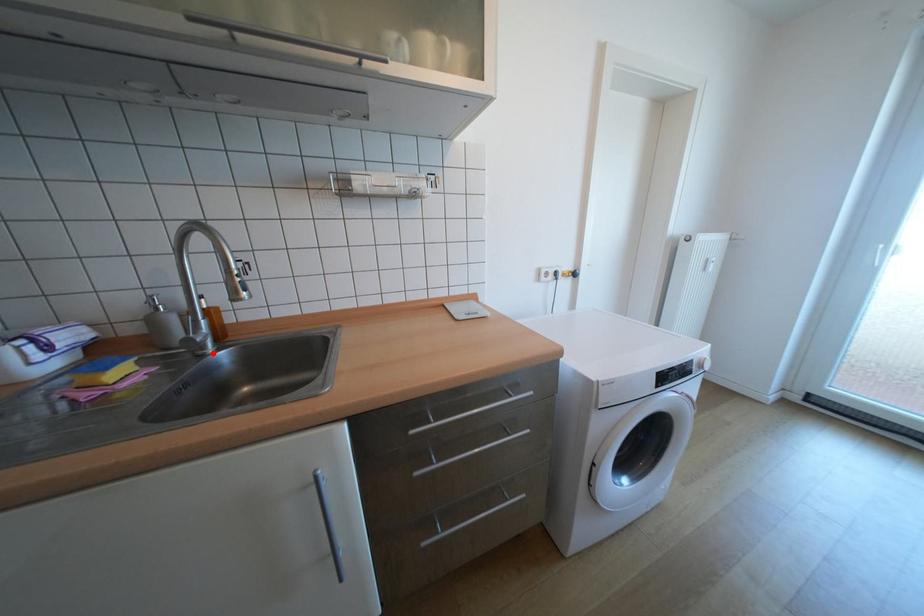
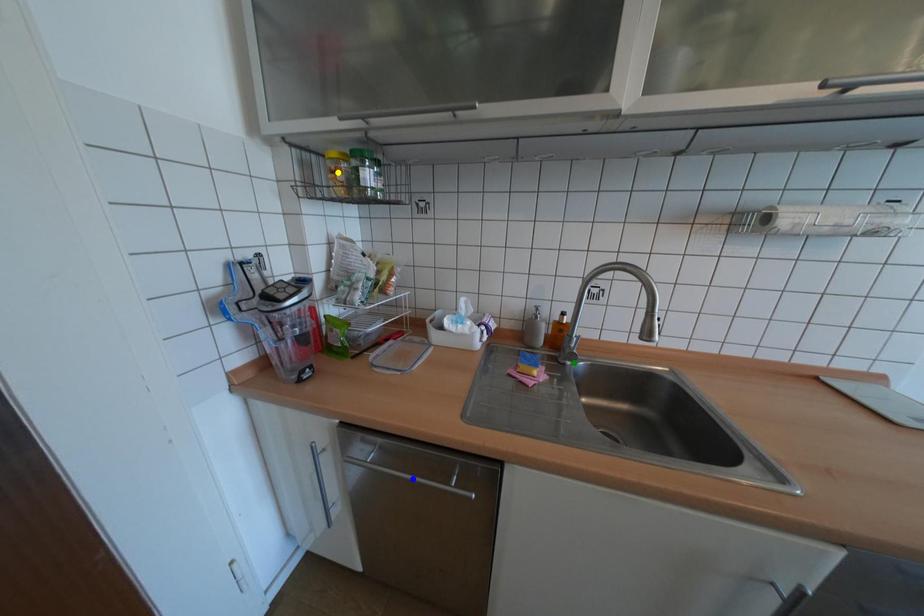
Question: I am providing you with two images of the same scene from different viewpoints. A red point is marked on the first image. You are given multiple points on the second image. Which mark in image 2 goes with the point in image 1?

Choices:
 (A) green point
 (B) blue point
 (C) yellow point

Answer: (A)